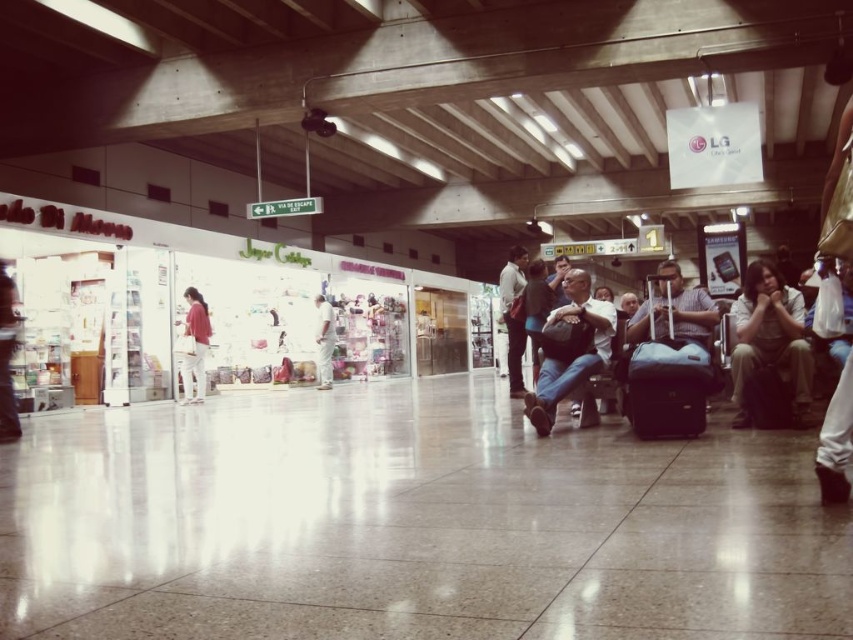
Question: Can you confirm if matte red shirt at center is wider than dark blue jeans at center?

Choices:
 (A) yes
 (B) no

Answer: (B)

Question: Which of the following is the closest to the observer?

Choices:
 (A) matte black bag at center
 (B) matte red shirt at center
 (C) black leather suitcase at right

Answer: (C)

Question: Which is farther from the dark blue jeans at center?

Choices:
 (A) black fabric suitcase at lower right
 (B) white shirt at center
 (C) matte red shirt at center

Answer: (C)

Question: Observing the image, what is the correct spatial positioning of white shirt at center in reference to matte red shirt at center?

Choices:
 (A) above
 (B) below

Answer: (B)

Question: Can you confirm if matte red shirt at center is positioned to the left of dark blue jeans at center?

Choices:
 (A) no
 (B) yes

Answer: (B)

Question: Based on their relative distances, which object is farther from the black fabric suitcase at lower right?

Choices:
 (A) dark blue jeans at center
 (B) light brown fabric pants at lower right
 (C) white shirt at center
 (D) black leather suitcase at right

Answer: (C)